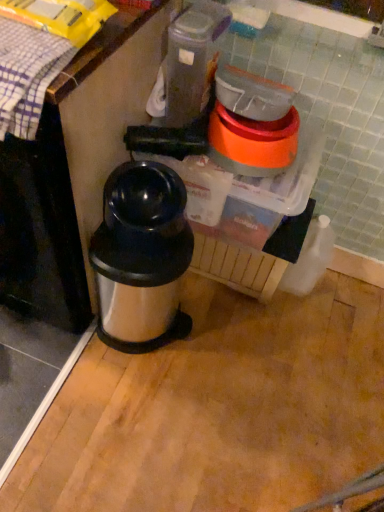
Question: Is silver metallic thermos at center behind black plastic blender at center?

Choices:
 (A) no
 (B) yes

Answer: (A)

Question: Is silver metallic thermos at center bigger than black plastic blender at center?

Choices:
 (A) no
 (B) yes

Answer: (A)

Question: Is silver metallic thermos at center oriented away from black plastic blender at center?

Choices:
 (A) no
 (B) yes

Answer: (B)

Question: Would you say black plastic blender at center is part of silver metallic thermos at center's contents?

Choices:
 (A) no
 (B) yes

Answer: (A)

Question: Is silver metallic thermos at center at the left side of black plastic blender at center?

Choices:
 (A) yes
 (B) no

Answer: (A)

Question: Considering the relative sizes of silver metallic thermos at center and black plastic blender at center in the image provided, is silver metallic thermos at center thinner than black plastic blender at center?

Choices:
 (A) no
 (B) yes

Answer: (B)

Question: From a real-world perspective, is black plastic blender at center located higher than plaid fabric at upper left?

Choices:
 (A) no
 (B) yes

Answer: (A)

Question: Does black plastic blender at center have a lesser height compared to plaid fabric at upper left?

Choices:
 (A) no
 (B) yes

Answer: (A)

Question: Is black plastic blender at center wider than plaid fabric at upper left?

Choices:
 (A) yes
 (B) no

Answer: (A)

Question: Would you say black plastic blender at center contains plaid fabric at upper left?

Choices:
 (A) no
 (B) yes

Answer: (A)

Question: From the image's perspective, is black plastic blender at center below plaid fabric at upper left?

Choices:
 (A) no
 (B) yes

Answer: (B)

Question: Does black plastic blender at center appear on the right side of plaid fabric at upper left?

Choices:
 (A) yes
 (B) no

Answer: (A)

Question: Is plaid fabric at upper left closer to the viewer compared to black plastic blender at center?

Choices:
 (A) no
 (B) yes

Answer: (B)